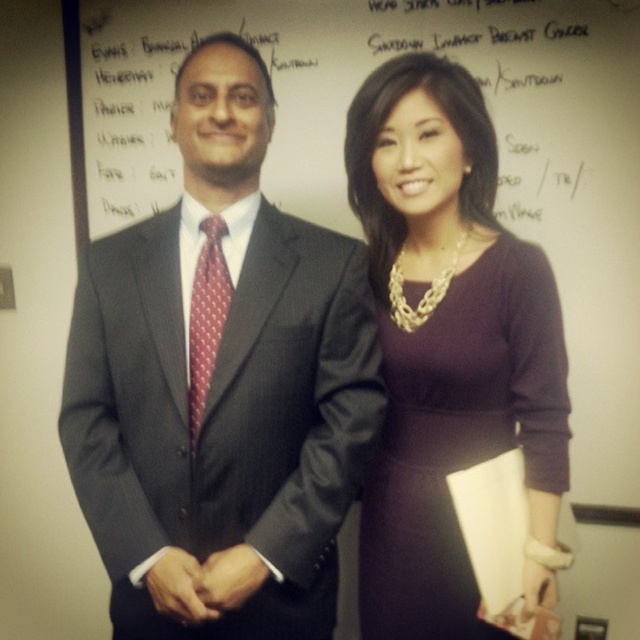
Is whiteboard at upper center to the left of matte purple dress at center from the viewer's perspective?

Correct, you'll find whiteboard at upper center to the left of matte purple dress at center.

The height and width of the screenshot is (640, 640). What do you see at coordinates (342, 140) in the screenshot?
I see `whiteboard at upper center` at bounding box center [342, 140].

Where is `whiteboard at upper center`? This screenshot has width=640, height=640. whiteboard at upper center is located at coordinates (342, 140).

Between point (358, 582) and point (188, 316), which one is positioned in front?

Positioned in front is point (188, 316).

Locate an element on the screen. The height and width of the screenshot is (640, 640). matte purple dress at center is located at coordinates (460, 436).

Can you confirm if dark gray suit at center is positioned below red dotted tie at center?

Indeed, dark gray suit at center is positioned under red dotted tie at center.

Can you confirm if dark gray suit at center is positioned to the right of red dotted tie at center?

Yes, dark gray suit at center is to the right of red dotted tie at center.

Describe the element at coordinates (220, 385) in the screenshot. The width and height of the screenshot is (640, 640). I see `dark gray suit at center` at that location.

I want to click on dark gray suit at center, so click(x=220, y=385).